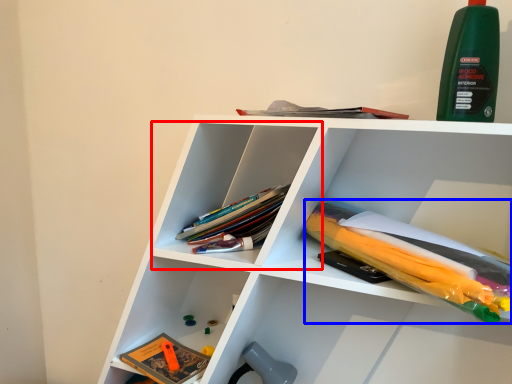
Question: Which object appears closest to the camera in this image, cabinet (highlighted by a red box) or book (highlighted by a blue box)?

Choices:
 (A) cabinet
 (B) book

Answer: (B)